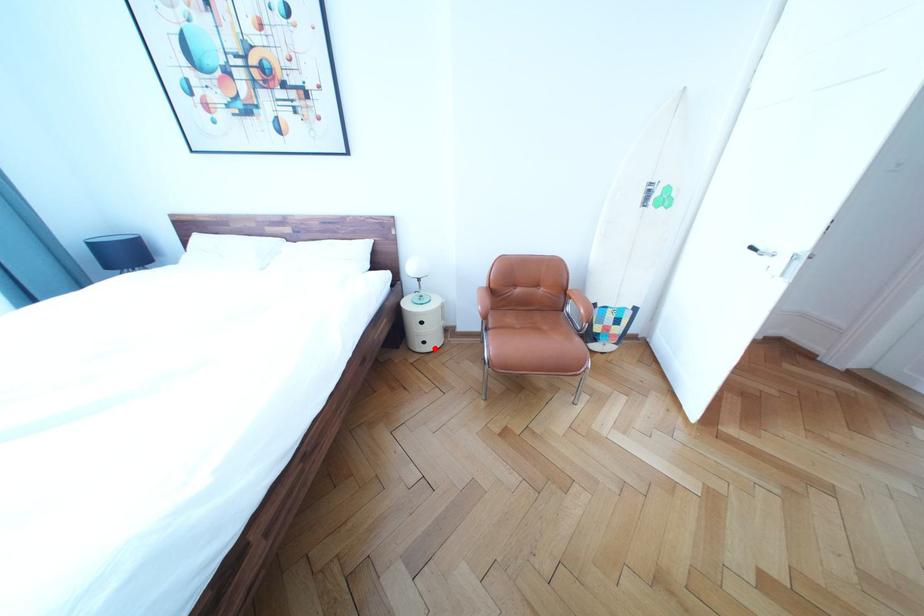
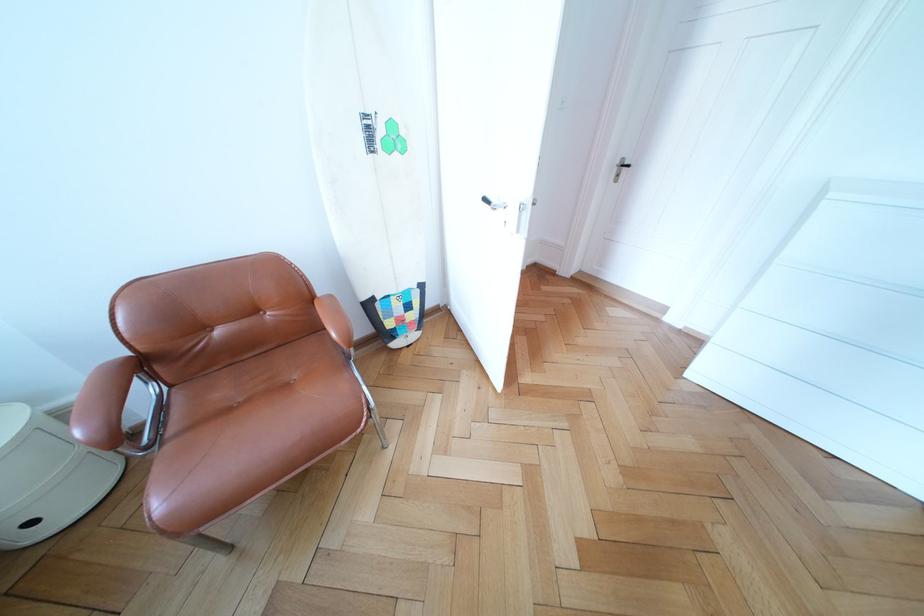
Find the pixel in the second image that matches the highlighted location in the first image.

(43, 529)